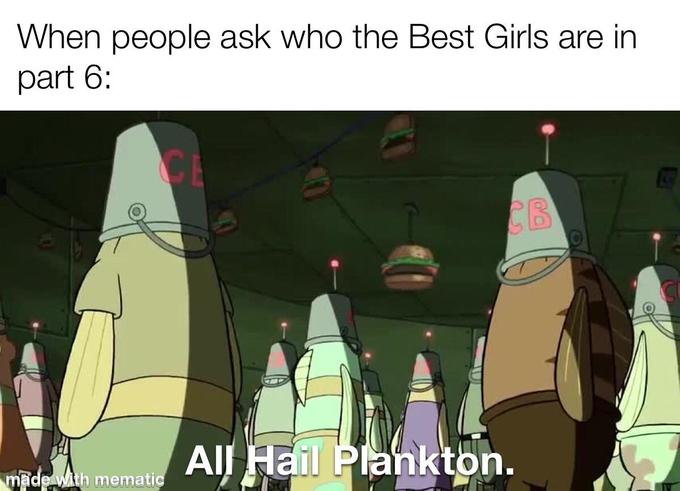
The width and height of the screenshot is (680, 491). Identify the location of metal ceiling. (474, 156).